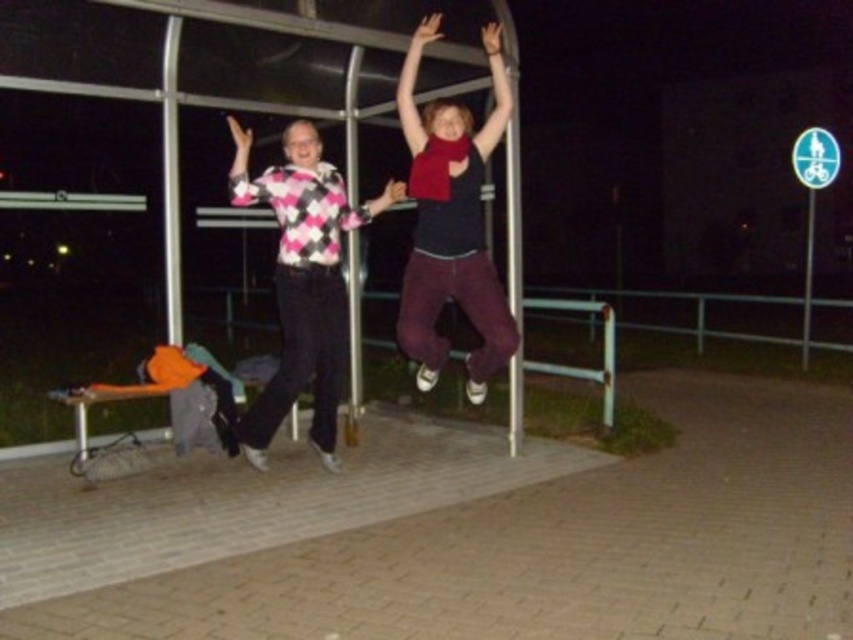
Is point (418, 122) in front of point (300, 253)?

Yes, it is in front of point (300, 253).

Who is lower down, matte red scarf at upper center or pink argyle sweater at center?

pink argyle sweater at center

Find the location of a particular element. This screenshot has width=853, height=640. matte red scarf at upper center is located at coordinates (451, 221).